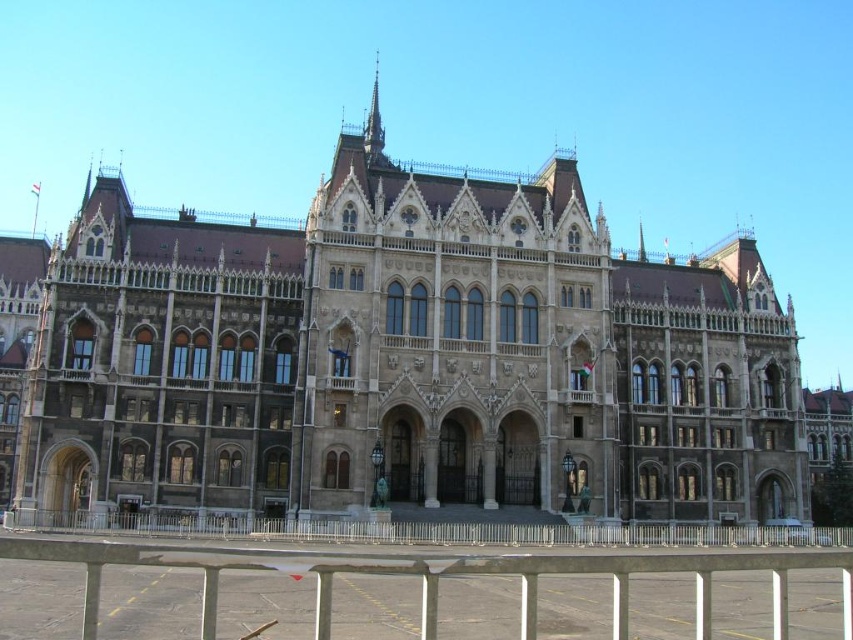
Question: Can you confirm if metallic silver rail at lower center is positioned below metallic silver fence at lower center?

Choices:
 (A) yes
 (B) no

Answer: (B)

Question: Which object appears closest to the camera in this image?

Choices:
 (A) metallic silver rail at lower center
 (B) metallic silver fence at lower center

Answer: (A)

Question: Which of the following is the farthest from the observer?

Choices:
 (A) (312, 561)
 (B) (358, 524)

Answer: (B)

Question: Is metallic silver rail at lower center wider than metallic silver fence at lower center?

Choices:
 (A) no
 (B) yes

Answer: (A)

Question: Is metallic silver rail at lower center bigger than metallic silver fence at lower center?

Choices:
 (A) yes
 (B) no

Answer: (A)